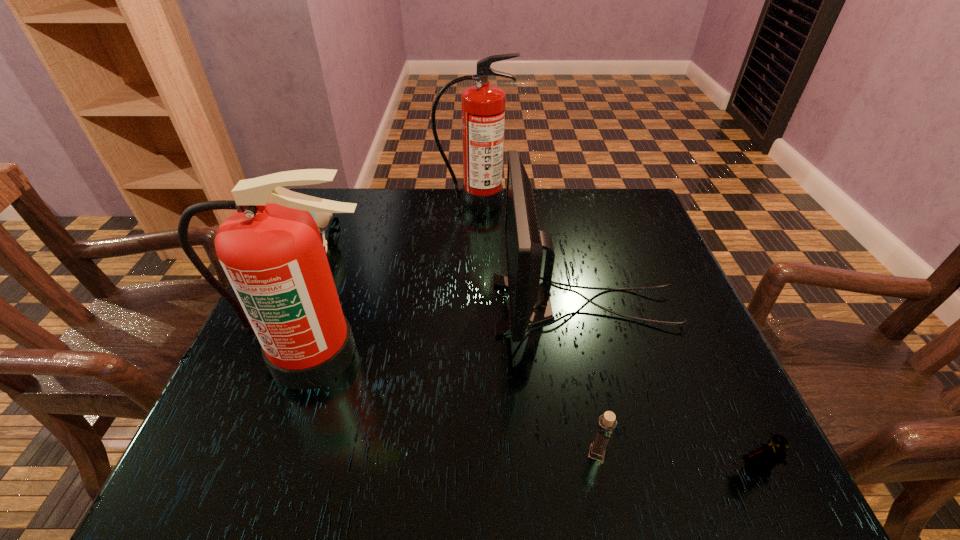
Where is `the farther fire extinguisher`? the farther fire extinguisher is located at coordinates (482, 106).

At what (x,y) coordinates should I click in order to perform the action: click on the right fire extinguisher. Please return your answer as a coordinate pair (x, y). This screenshot has width=960, height=540. Looking at the image, I should click on (482, 106).

Identify the location of the nearer fire extinguisher. The width and height of the screenshot is (960, 540). (271, 250).

Identify the location of the fourth shortest object. This screenshot has width=960, height=540. (530, 305).

Locate an element on the screen. the fourth tallest object is located at coordinates (322, 219).

Image resolution: width=960 pixels, height=540 pixels. In order to click on the fifth tallest object in this screenshot , I will do `click(607, 422)`.

I want to click on the shortest object, so click(762, 461).

Locate an element on the screen. This screenshot has width=960, height=540. free space located on the front-facing side of the farthest object is located at coordinates (473, 271).

What are the coordinates of `vacant region located at the nozzle of the left fire extinguisher` in the screenshot? It's located at (283, 443).

Find the location of a particular element. vacant space positioned 0.100m on the screen side of the computer monitor is located at coordinates (447, 305).